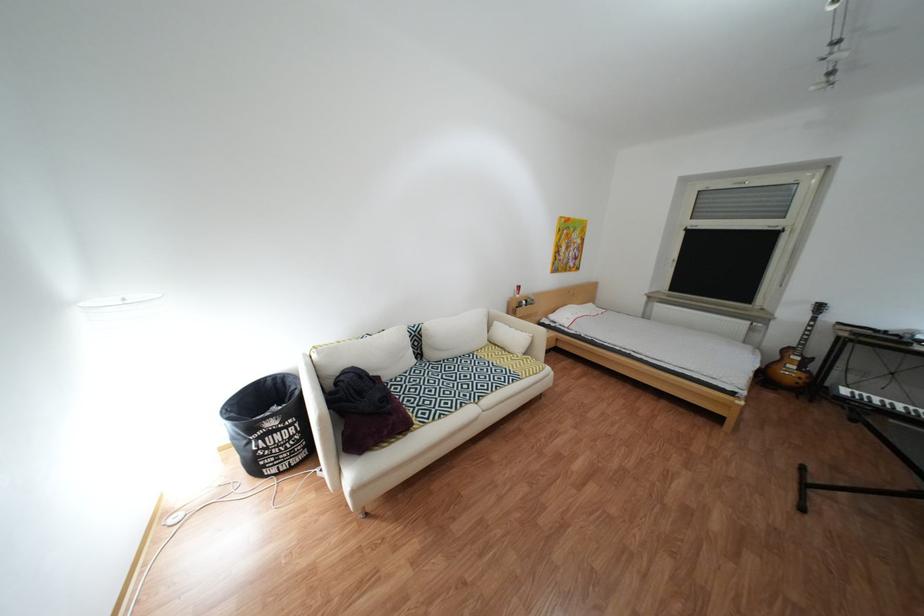
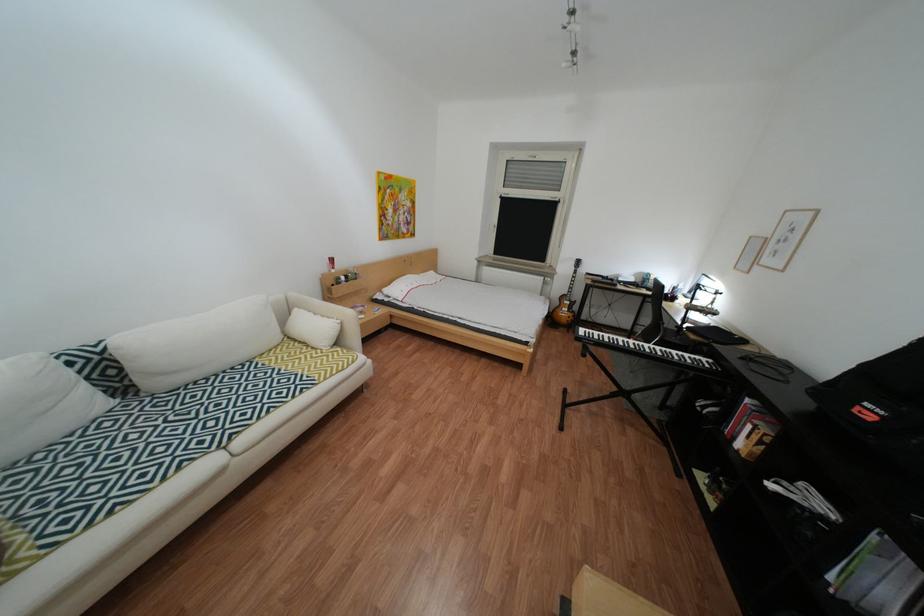
Locate, in the second image, the point that corresponds to point (893, 403) in the first image.

(612, 338)